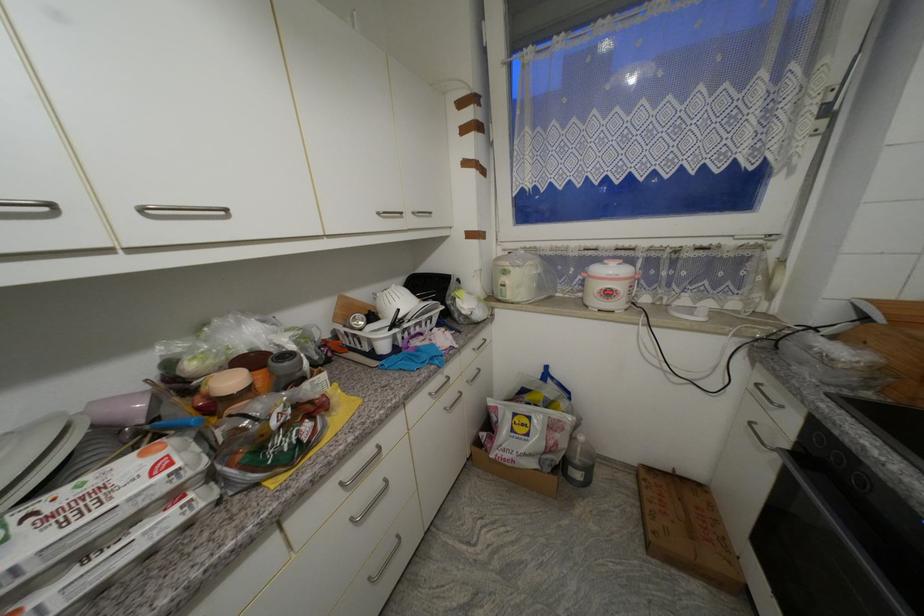
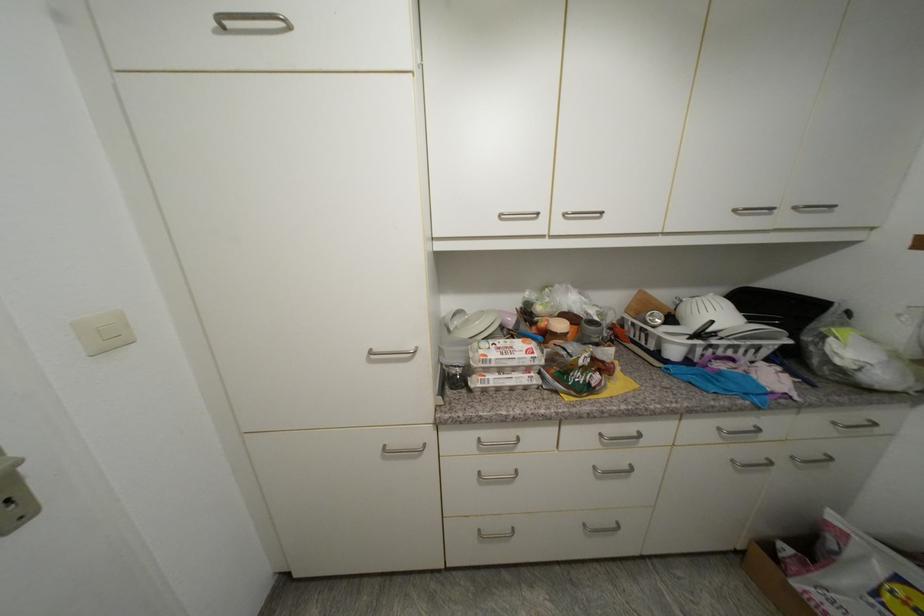
Find the pixel in the second image that matches (264,386) in the first image.

(575, 336)